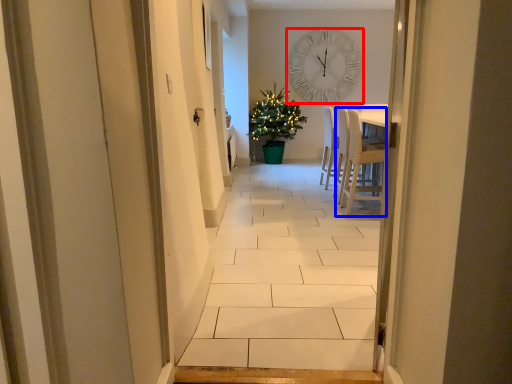
Question: Among these objects, which one is nearest to the camera, wall clock (highlighted by a red box) or chair (highlighted by a blue box)?

Choices:
 (A) wall clock
 (B) chair

Answer: (B)